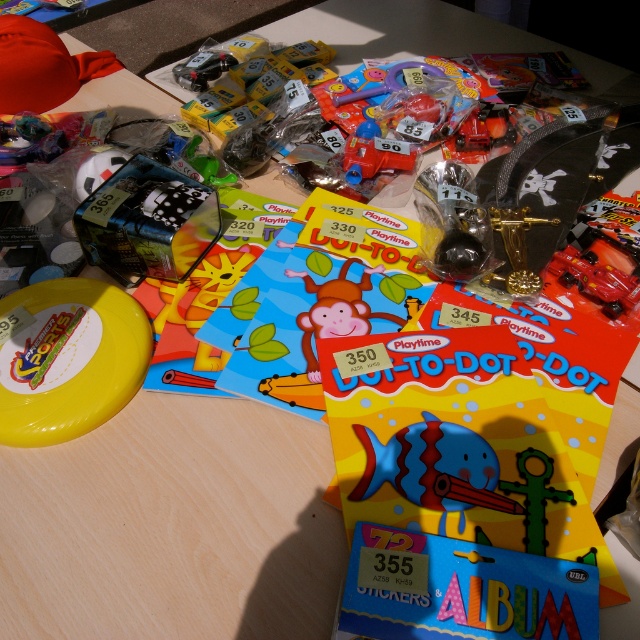
You are a parent trying to choose between the shiny red car at center and the translucent plastic toy car at center for your child. Which one is wider?

The translucent plastic toy car at center is wider than the shiny red car at center.

Consider the image. You are a parent trying to choose between the shiny red car at center and the translucent plastic toy car at center for your child. Which one is shorter in height?

The shiny red car at center is not as tall as the translucent plastic toy car at center, so the shiny red car at center is shorter in height.

What object is located at the coordinates point (337,310) in the image?

The point (337,310) is on the matte yellow frisbee at center.